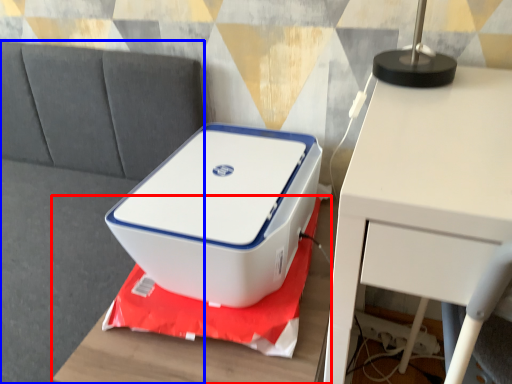
Question: Which point is closer to the camera, furniture (highlighted by a red box) or couch (highlighted by a blue box)?

Choices:
 (A) furniture
 (B) couch

Answer: (B)